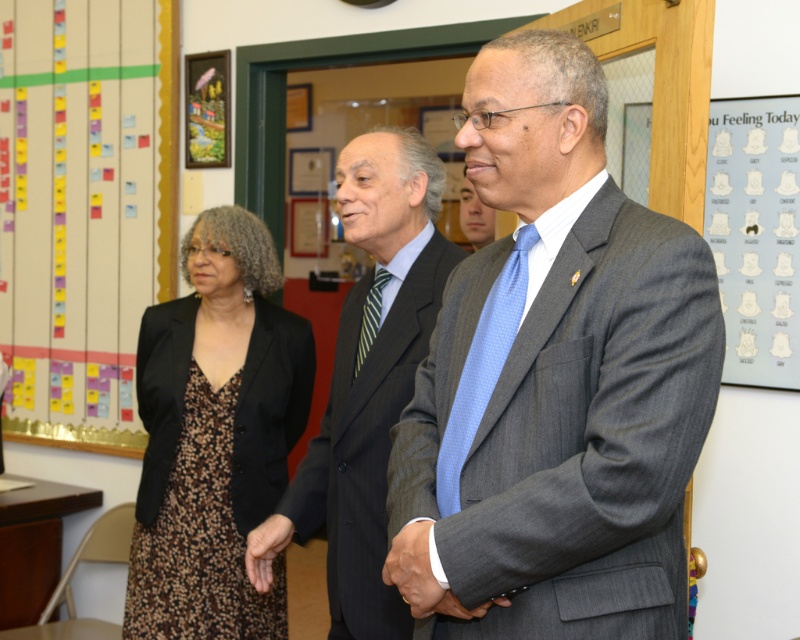
Is point (344, 445) behind point (440, 470)?

Yes, it is behind point (440, 470).

Does dark gray suit at center have a larger size compared to blue silk tie at center?

Yes.

Does point (408, 209) lie in front of point (464, 456)?

No, it is behind (464, 456).

The width and height of the screenshot is (800, 640). Find the location of `dark gray suit at center`. dark gray suit at center is located at coordinates [372, 372].

Who is more forward, (248, 408) or (252, 577)?

Point (252, 577)

Does leopard print dress at left have a smaller size compared to leather textured hand at center?

Actually, leopard print dress at left might be larger than leather textured hand at center.

From the picture: Who is more distant from viewer, (132, 550) or (256, 577)?

Positioned behind is point (132, 550).

What are the coordinates of `leopard print dress at left` in the screenshot? It's located at (214, 436).

Does smooth skin hand at center have a greater height compared to green striped tie at center?

No, smooth skin hand at center is not taller than green striped tie at center.

Image resolution: width=800 pixels, height=640 pixels. What do you see at coordinates (412, 568) in the screenshot? I see `smooth skin hand at center` at bounding box center [412, 568].

Describe the element at coordinates (412, 568) in the screenshot. I see `smooth skin hand at center` at that location.

At what (x,y) coordinates should I click in order to perform the action: click on smooth skin hand at center. Please return your answer as a coordinate pair (x, y). This screenshot has height=640, width=800. Looking at the image, I should click on (412, 568).